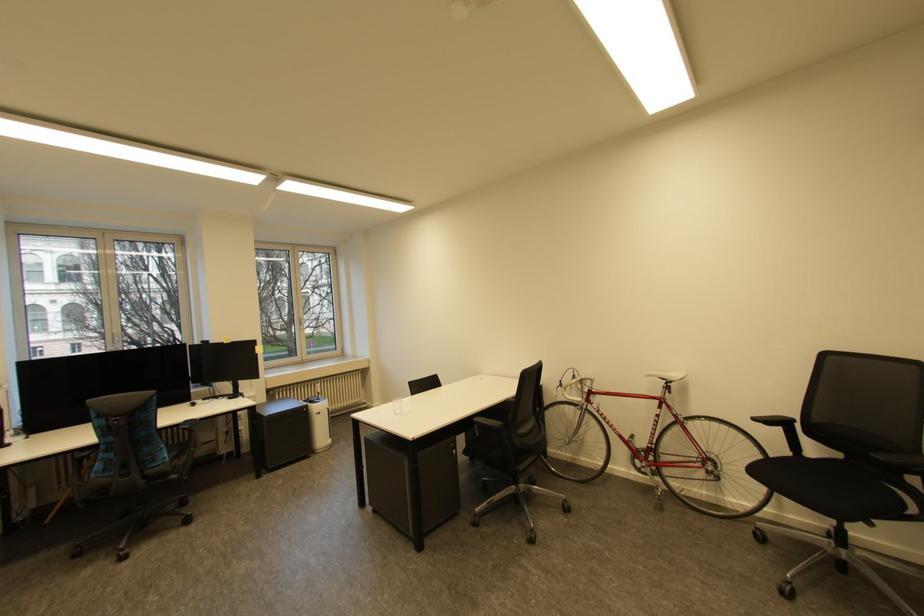
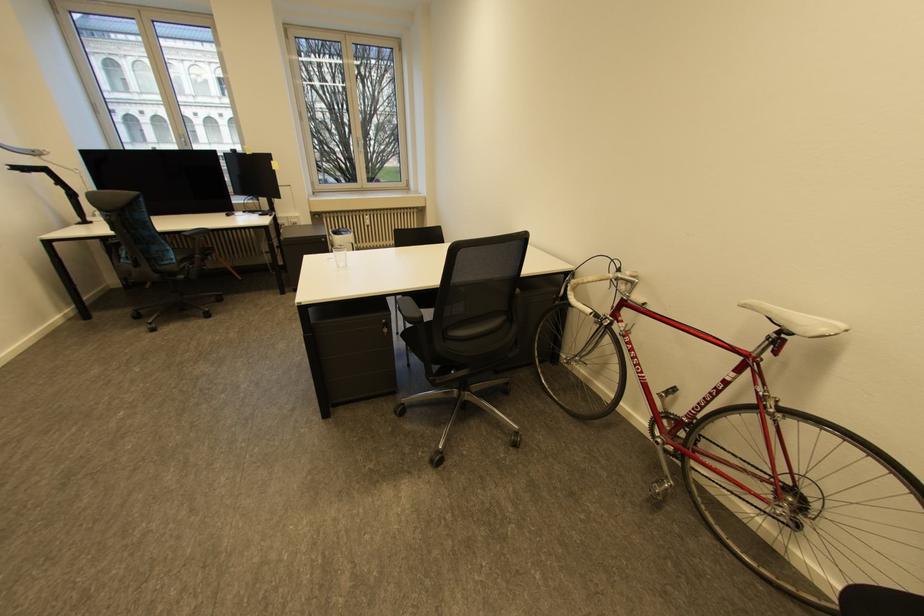
In the second image, find the point that corresponds to (x=675, y=383) in the first image.

(789, 331)